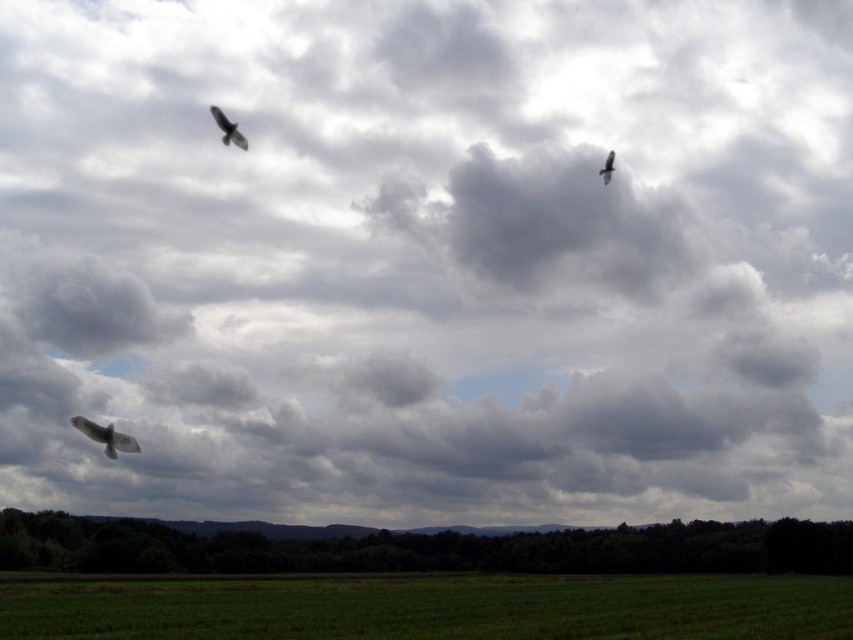
Can you confirm if dark gray feathers at upper left is shorter than dark gray feathers at upper right?

Correct, dark gray feathers at upper left is not as tall as dark gray feathers at upper right.

Between dark gray feathers at upper left and dark gray feathers at upper right, which one has more height?

dark gray feathers at upper right

Based on the photo, who is more distant from viewer, (x=231, y=140) or (x=611, y=166)?

Positioned behind is point (x=611, y=166).

Where is `dark gray feathers at upper left`? This screenshot has width=853, height=640. dark gray feathers at upper left is located at coordinates (228, 129).

Between green grassy field at lower center and white feathered bird at lower left, which one appears on the left side from the viewer's perspective?

white feathered bird at lower left is more to the left.

In the scene shown: Can you confirm if green grassy field at lower center is wider than white feathered bird at lower left?

Indeed, green grassy field at lower center has a greater width compared to white feathered bird at lower left.

Who is more forward, [299,586] or [134,451]?

Positioned in front is point [134,451].

The height and width of the screenshot is (640, 853). I want to click on green grassy field at lower center, so click(x=433, y=609).

Does white feathered bird at lower left appear under dark gray feathers at upper left?

Yes, white feathered bird at lower left is below dark gray feathers at upper left.

Who is taller, white feathered bird at lower left or dark gray feathers at upper left?

dark gray feathers at upper left is taller.

Does point (93, 435) lie in front of point (213, 106)?

Yes, point (93, 435) is in front of point (213, 106).

Image resolution: width=853 pixels, height=640 pixels. Find the location of `white feathered bird at lower left`. white feathered bird at lower left is located at coordinates (105, 436).